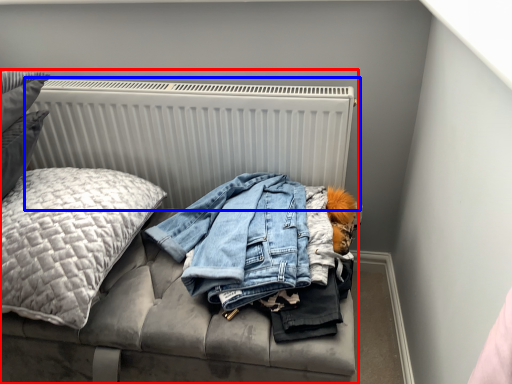
Question: Among these objects, which one is nearest to the camera, furniture (highlighted by a red box) or radiator (highlighted by a blue box)?

Choices:
 (A) furniture
 (B) radiator

Answer: (A)